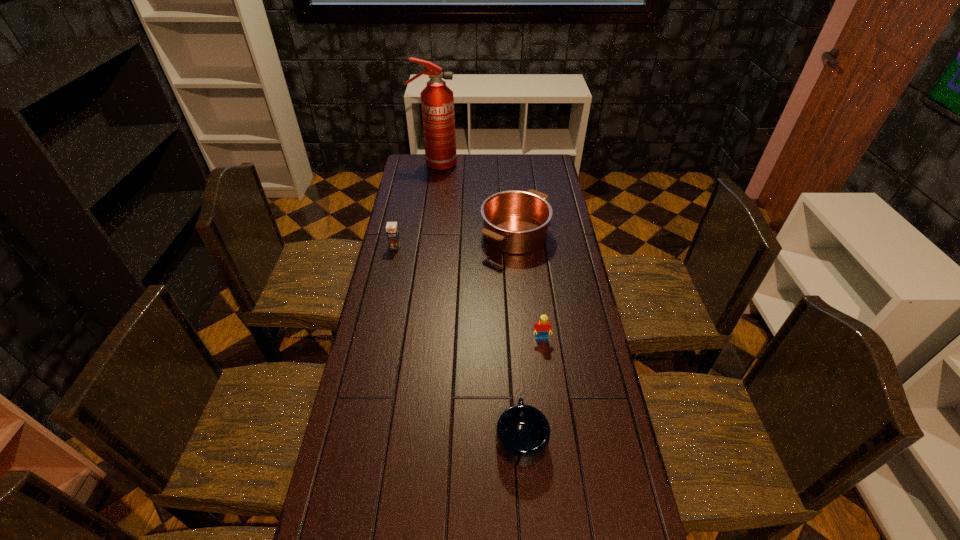
The image size is (960, 540). What are the coordinates of `object that can be found as the second closest to the farthest object` in the screenshot? It's located at (392, 231).

You are a GUI agent. You are given a task and a screenshot of the screen. Output one action in this format:
    pyautogui.click(x=<x>, y=<y>)
    Task: Click on the vacant position in the image that satisfies the following two spatial constraints: 1. with the handle on the side of the mug; 2. on the right side of the saucepan
    
    Given the screenshot: What is the action you would take?
    pyautogui.click(x=507, y=234)